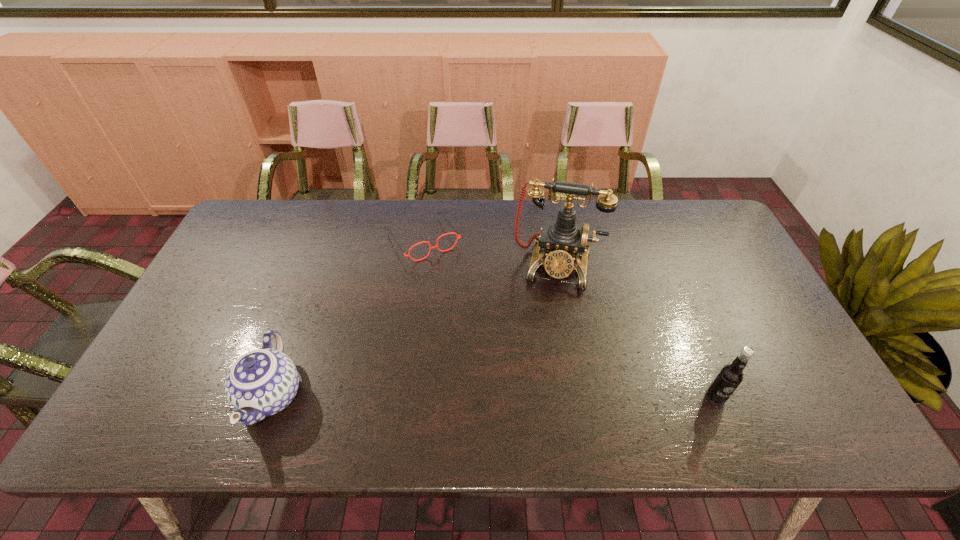
Locate an element on the screen. vacant area that lies between the root beer and the shortest object is located at coordinates (569, 318).

Locate an element on the screen. The height and width of the screenshot is (540, 960). vacant region between the chinaware and the second object from left to right is located at coordinates [x=348, y=318].

Locate an element on the screen. Image resolution: width=960 pixels, height=540 pixels. vacant area between the rightmost object and the shortest object is located at coordinates (569, 318).

In order to click on the closest object to the second object from right to left in this screenshot , I will do `click(436, 246)`.

Select which object appears as the closest to the chinaware. Please provide its 2D coordinates. Your answer should be formatted as a tuple, i.e. [(x, y)], where the tuple contains the x and y coordinates of a point satisfying the conditions above.

[(436, 246)]